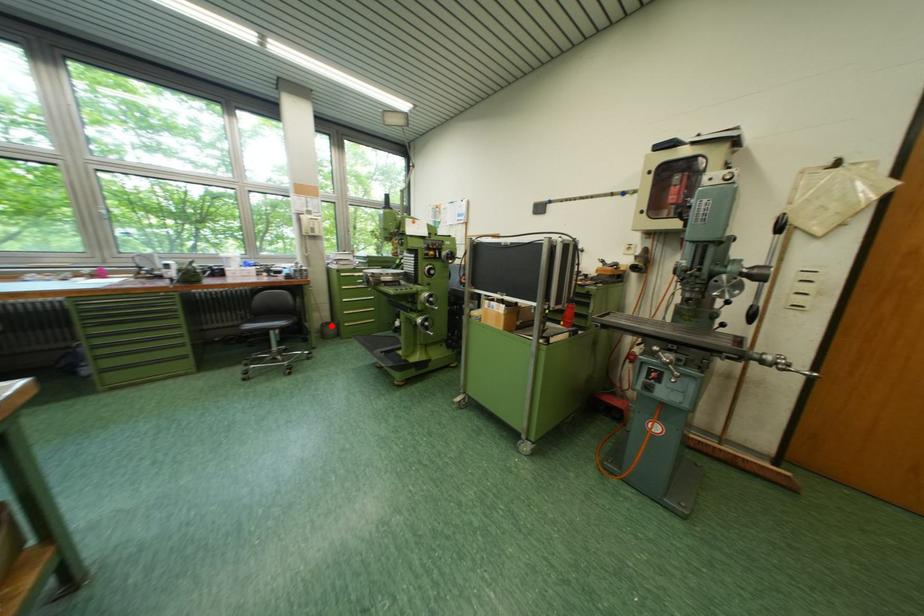
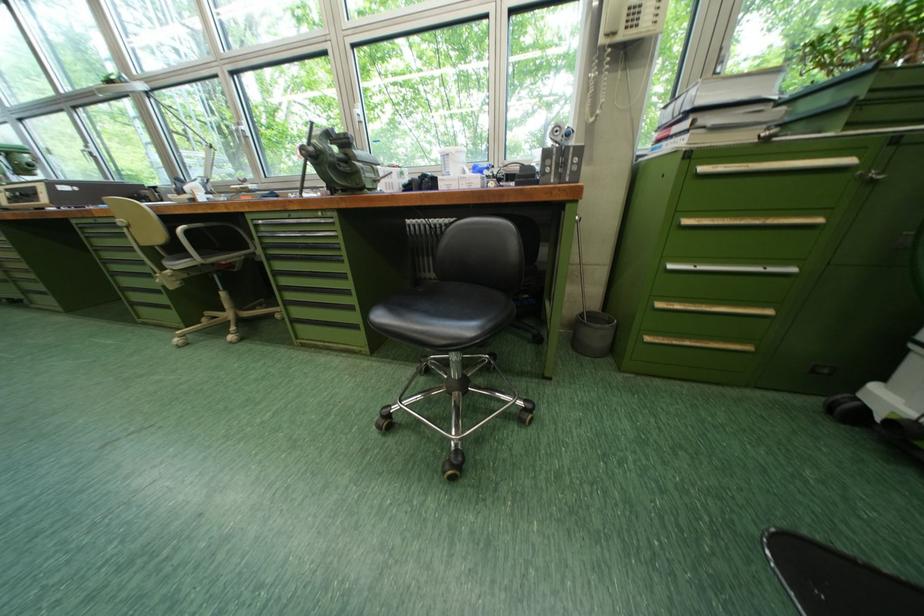
Locate, in the second image, the point that corresponds to the highlighted location in the first image.

(589, 315)